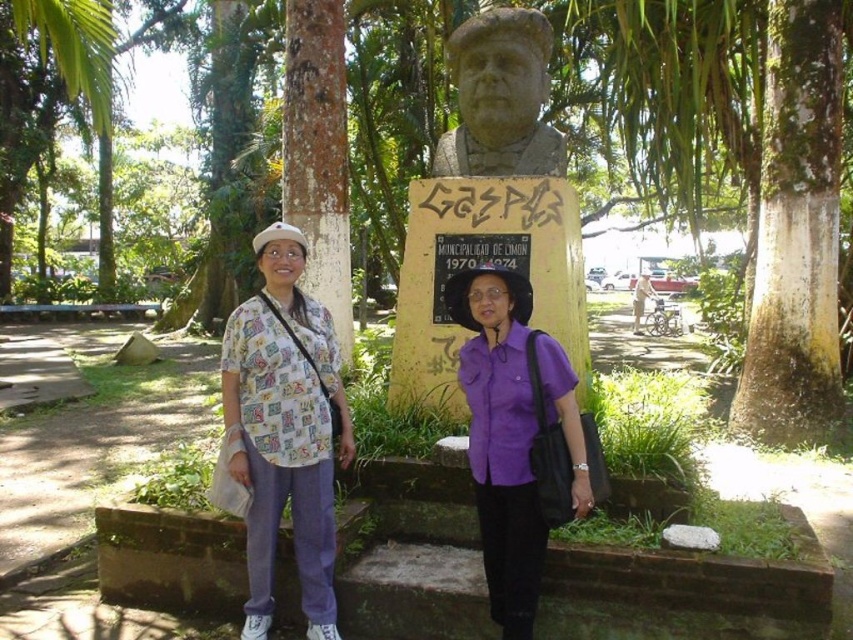
Question: Is purple matte shirt at center smaller than stone statue at center?

Choices:
 (A) yes
 (B) no

Answer: (B)

Question: Does printed fabric shirt at center come in front of purple matte shirt at center?

Choices:
 (A) no
 (B) yes

Answer: (A)

Question: Estimate the real-world distances between objects in this image. Which object is closer to the stone statue at center?

Choices:
 (A) printed fabric shirt at center
 (B) printed cotton shirt at left

Answer: (B)

Question: Estimate the real-world distances between objects in this image. Which object is closer to the purple matte shirt at center?

Choices:
 (A) green bark tree at center
 (B) printed cotton shirt at left
 (C) printed fabric shirt at center
 (D) stone statue at center

Answer: (C)

Question: Does green bark tree at center come behind printed fabric shirt at center?

Choices:
 (A) no
 (B) yes

Answer: (B)

Question: Which of the following is the farthest from the observer?

Choices:
 (A) (519, 19)
 (B) (296, 548)
 (C) (476, 488)
 (D) (346, 460)

Answer: (A)